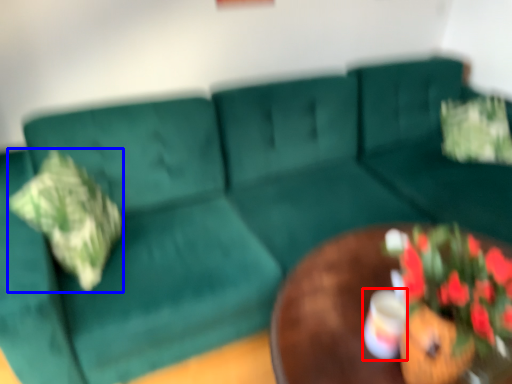
Question: Which of the following is the farthest to the observer, coffee cup (highlighted by a red box) or pillow (highlighted by a blue box)?

Choices:
 (A) coffee cup
 (B) pillow

Answer: (B)